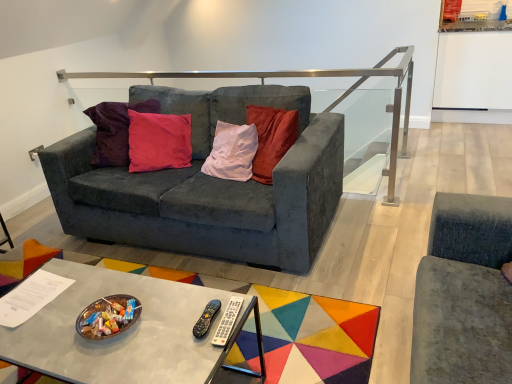
The height and width of the screenshot is (384, 512). Identify the location of silver plastic remote at center, arranged as the 1th remote when viewed from the right. (227, 321).

Where is `satin silver rail at upper center`? This screenshot has width=512, height=384. satin silver rail at upper center is located at coordinates (310, 77).

Between velvet dark gray couch at center and silver plastic remote at center, the 2th remote when ordered from left to right, which one has smaller width?

Thinner between the two is silver plastic remote at center, the 2th remote when ordered from left to right.

Considering the positions of objects velvet dark gray couch at center and silver plastic remote at center, arranged as the 1th remote when viewed from the right, in the image provided, who is more to the left, velvet dark gray couch at center or silver plastic remote at center, arranged as the 1th remote when viewed from the right,?

From the viewer's perspective, velvet dark gray couch at center appears more on the left side.

Is velvet dark gray couch at center smaller than silver plastic remote at center, arranged as the 1th remote when viewed from the right?

Actually, velvet dark gray couch at center might be larger than silver plastic remote at center, arranged as the 1th remote when viewed from the right.

In the scene shown: Is velvet dark gray couch at center not within silver plastic remote at center, arranged as the 1th remote when viewed from the right?

Yes, velvet dark gray couch at center is outside of silver plastic remote at center, arranged as the 1th remote when viewed from the right.

In terms of height, does velvet dark gray couch at center look taller or shorter compared to metallic gray coffee table at center?

Considering their sizes, velvet dark gray couch at center has more height than metallic gray coffee table at center.

Is velvet dark gray couch at center not inside metallic gray coffee table at center?

velvet dark gray couch at center lies outside metallic gray coffee table at center's area.

Are velvet dark gray couch at center and metallic gray coffee table at center far apart?

No, there isn't a large distance between velvet dark gray couch at center and metallic gray coffee table at center.

The height and width of the screenshot is (384, 512). In order to click on studio couch located on the right of metallic gray coffee table at center in this screenshot , I will do `click(208, 185)`.

Is velvet dark gray couch at center located within black plastic remote at center, positioned as the 2th remote in right-to-left order?

Definitely not — velvet dark gray couch at center is not inside black plastic remote at center, positioned as the 2th remote in right-to-left order.

This screenshot has width=512, height=384. Identify the location of studio couch on the left of black plastic remote at center, which is the 1th remote from left to right. (208, 185).

Does black plastic remote at center, positioned as the 2th remote in right-to-left order, have a greater width compared to velvet dark gray couch at center?

No.

Which is more to the right, black plastic remote at center, which is the 1th remote from left to right, or velvet dark gray couch at center?

black plastic remote at center, which is the 1th remote from left to right.

From the image's perspective, which is below, satin silver rail at upper center or black plastic remote at center, which is the 1th remote from left to right?

From the image's view, black plastic remote at center, which is the 1th remote from left to right, is below.

Does satin silver rail at upper center lie in front of black plastic remote at center, positioned as the 2th remote in right-to-left order?

No, satin silver rail at upper center is further to the viewer.

Between satin silver rail at upper center and black plastic remote at center, positioned as the 2th remote in right-to-left order, which one appears on the right side from the viewer's perspective?

Positioned to the right is black plastic remote at center, positioned as the 2th remote in right-to-left order.

How distant is satin silver rail at upper center from black plastic remote at center, positioned as the 2th remote in right-to-left order?

They are 7.18 feet apart.

In the image, is satin silver rail at upper center positioned in front of or behind velvet dark gray couch at center?

satin silver rail at upper center is positioned farther from the viewer than velvet dark gray couch at center.

At what (x,y) coordinates should I click in order to perform the action: click on studio couch below the satin silver rail at upper center (from the image's perspective). Please return your answer as a coordinate pair (x, y). The width and height of the screenshot is (512, 384). Looking at the image, I should click on (208, 185).

Is satin silver rail at upper center next to velvet dark gray couch at center and touching it?

No, satin silver rail at upper center is not in contact with velvet dark gray couch at center.

Do you think satin silver rail at upper center is within velvet dark gray couch at center, or outside of it?

satin silver rail at upper center exists entirely within velvet dark gray couch at center.

Is velvet dark gray couch at center located outside satin silver rail at upper center?

velvet dark gray couch at center is positioned outside satin silver rail at upper center.

Consider the image. From a real-world perspective, who is located higher, velvet dark gray couch at center or satin silver rail at upper center?

In real-world perspective, satin silver rail at upper center is above.

Which object is further away from the camera, velvet dark gray couch at center or satin silver rail at upper center?

satin silver rail at upper center is further from the camera.

From the image's perspective, is satin silver rail at upper center located above or below metallic gray coffee table at center?

Based on their image positions, satin silver rail at upper center is located above metallic gray coffee table at center.

Between satin silver rail at upper center and metallic gray coffee table at center, which one has smaller size?

metallic gray coffee table at center.

Is satin silver rail at upper center wider than metallic gray coffee table at center?

Incorrect, the width of satin silver rail at upper center does not surpass that of metallic gray coffee table at center.

Is satin silver rail at upper center facing towards metallic gray coffee table at center?

Yes, satin silver rail at upper center is facing metallic gray coffee table at center.

This screenshot has width=512, height=384. I want to click on studio couch located above the silver plastic remote at center, arranged as the 1th remote when viewed from the right (from the image's perspective), so click(208, 185).

At what (x,y) coordinates should I click in order to perform the action: click on coffee table below the velvet dark gray couch at center (from the image's perspective). Please return your answer as a coordinate pair (x, y). This screenshot has height=384, width=512. Looking at the image, I should click on (119, 334).

When comparing their distances from metallic gray coffee table at center, does silver plastic remote at center, arranged as the 1th remote when viewed from the right, or satin silver rail at upper center seem further?

Based on the image, satin silver rail at upper center appears to be further to metallic gray coffee table at center.

Which object lies nearer to the anchor point velvet dark gray couch at center, silver plastic remote at center, arranged as the 1th remote when viewed from the right, or satin silver rail at upper center?

The object closer to velvet dark gray couch at center is satin silver rail at upper center.

Considering their positions, is satin silver rail at upper center positioned closer to metallic gray coffee table at center than silver plastic remote at center, arranged as the 1th remote when viewed from the right?

silver plastic remote at center, arranged as the 1th remote when viewed from the right, lies closer to metallic gray coffee table at center than the other object.

Which object lies nearer to the anchor point black plastic remote at center, which is the 1th remote from left to right, velvet dark gray couch at center or silver plastic remote at center, the 2th remote when ordered from left to right?

Among the two, silver plastic remote at center, the 2th remote when ordered from left to right, is located nearer to black plastic remote at center, which is the 1th remote from left to right.

Estimate the real-world distances between objects in this image. Which object is further from black plastic remote at center, positioned as the 2th remote in right-to-left order, silver plastic remote at center, arranged as the 1th remote when viewed from the right, or velvet dark gray couch at center?

velvet dark gray couch at center.

Looking at the image, which one is located further to satin silver rail at upper center, metallic gray coffee table at center or velvet dark gray couch at center?

Among the two, metallic gray coffee table at center is located further to satin silver rail at upper center.

Estimate the real-world distances between objects in this image. Which object is further from satin silver rail at upper center, black plastic remote at center, positioned as the 2th remote in right-to-left order, or silver plastic remote at center, the 2th remote when ordered from left to right?

Based on the image, black plastic remote at center, positioned as the 2th remote in right-to-left order, appears to be further to satin silver rail at upper center.

Estimate the real-world distances between objects in this image. Which object is closer to satin silver rail at upper center, metallic gray coffee table at center or silver plastic remote at center, arranged as the 1th remote when viewed from the right?

metallic gray coffee table at center.

At what (x,y) coordinates should I click in order to perform the action: click on remote between velvet dark gray couch at center and black plastic remote at center, positioned as the 2th remote in right-to-left order, from top to bottom. Please return your answer as a coordinate pair (x, y). Looking at the image, I should click on (227, 321).

I want to click on studio couch positioned between metallic gray coffee table at center and satin silver rail at upper center from near to far, so click(208, 185).

You are a GUI agent. You are given a task and a screenshot of the screen. Output one action in this format:
    pyautogui.click(x=<x>, y=<y>)
    Task: Click on the remote between metallic gray coffee table at center and silver plastic remote at center, the 2th remote when ordered from left to right, in the horizontal direction
    The height and width of the screenshot is (384, 512).
    Given the screenshot: What is the action you would take?
    pyautogui.click(x=206, y=318)

The width and height of the screenshot is (512, 384). Find the location of `studio couch located between black plastic remote at center, which is the 1th remote from left to right, and satin silver rail at upper center in the depth direction`. studio couch located between black plastic remote at center, which is the 1th remote from left to right, and satin silver rail at upper center in the depth direction is located at coordinates (208, 185).